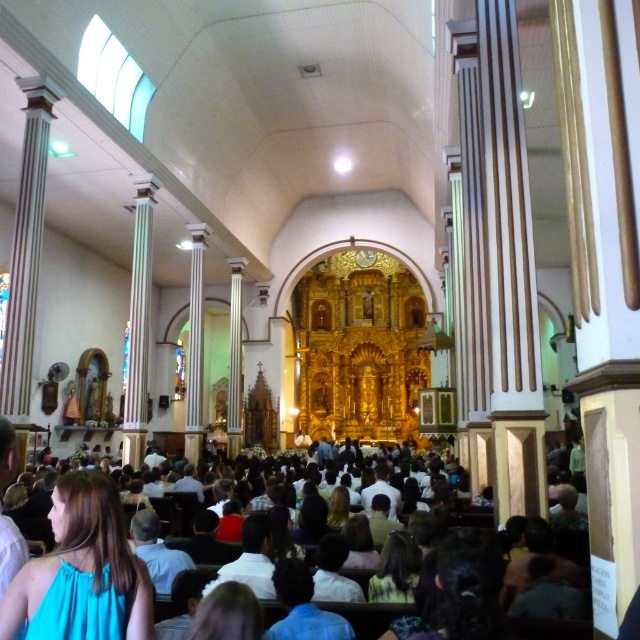
You are standing at the entrance of the church and notice two points marked in the image. The first point is located at coordinates point (65, 595) and the second at point (54, 582). Which of these points is closer to you?

Point (65, 595) is in front of point (54, 582), so it is closer to you.

You are standing at the entrance of the church and looking towards the altar. You see the white clothed crowd at center and the teal fabric dress at lower left. Which object is closer to the altar?

The teal fabric dress at lower left is closer to the altar because the white clothed crowd at center is below it, meaning the teal fabric dress is positioned in front of the crowd towards the altar.

In the scene shown: You are a photographer standing at the back of the church. You want to take a photo that includes both the white clothed crowd at center and the teal fabric dress at lower left. Given that your camera has a maximum focus range of 8 meters, will you be able to capture both subjects in focus at the same time?

The distance between the white clothed crowd at center and the teal fabric dress at lower left is 7.95 meters, which is within the camera maximum focus range of 8 meters. Therefore, you can capture both subjects in focus at the same time.